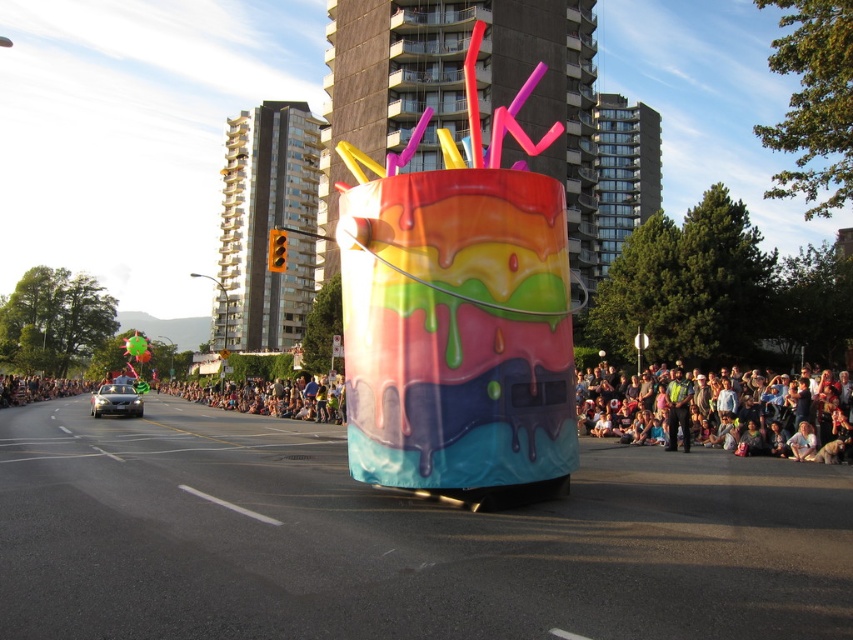
Question: Which of the following is the closest to the observer?

Choices:
 (A) (819, 435)
 (B) (137, 410)

Answer: (A)

Question: From the image, what is the correct spatial relationship of matte black crowd at lower right in relation to shiny black car at left?

Choices:
 (A) above
 (B) below

Answer: (A)

Question: Observing the image, what is the correct spatial positioning of matte black crowd at lower right in reference to shiny black car at left?

Choices:
 (A) right
 (B) left

Answer: (A)

Question: Which of the following is the farthest from the observer?

Choices:
 (A) matte black crowd at lower right
 (B) shiny black car at left

Answer: (B)

Question: Is matte black crowd at lower right bigger than shiny black car at left?

Choices:
 (A) yes
 (B) no

Answer: (B)

Question: Which point is closer to the camera?

Choices:
 (A) (125, 392)
 (B) (699, 410)

Answer: (B)